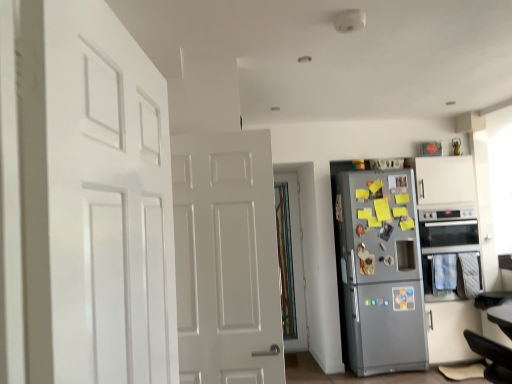
Locate an element on the screen. The image size is (512, 384). silver metallic oven at right is located at coordinates (446, 247).

Identify the location of translucent glass door at center, the 2th door positioned from the left. The width and height of the screenshot is (512, 384). (296, 261).

The image size is (512, 384). I want to click on white matte door at left, the second door in the right-to-left sequence, so click(106, 201).

Identify the location of black leather swivel chair at lower right. The height and width of the screenshot is (384, 512). (x=492, y=357).

Measure the distance between satin silver fridge at right and white matte door at left, the second door in the right-to-left sequence.

3.13 meters.

In terms of height, does satin silver fridge at right look taller or shorter compared to white matte door at left, the second door in the right-to-left sequence?

In the image, satin silver fridge at right appears to be taller than white matte door at left, the second door in the right-to-left sequence.

Is white matte door at left, the second door in the right-to-left sequence, completely or partially inside satin silver fridge at right?

Definitely not — white matte door at left, the second door in the right-to-left sequence, is not inside satin silver fridge at right.

Is satin silver fridge at right aimed at white matte door at left, the second door in the right-to-left sequence?

No, satin silver fridge at right is not facing towards white matte door at left, the second door in the right-to-left sequence.

Identify the location of oven on the right of satin silver fridge at right. The width and height of the screenshot is (512, 384). (446, 247).

Would you say silver metallic oven at right contains satin silver fridge at right?

Actually, satin silver fridge at right is outside silver metallic oven at right.

Is silver metallic oven at right turned away from satin silver fridge at right?

No, silver metallic oven at right's orientation is not away from satin silver fridge at right.

From a real-world perspective, does silver metallic oven at right sit lower than satin silver fridge at right?

Actually, silver metallic oven at right is physically above satin silver fridge at right in the real world.

Is white matte door at left, positioned as the 1th door in left-to-right order, not near translucent glass door at center, the 2th door positioned from the left?

white matte door at left, positioned as the 1th door in left-to-right order, is positioned a significant distance from translucent glass door at center, the 2th door positioned from the left.

From a real-world perspective, is white matte door at left, acting as the 2th door starting from the back, positioned above or below translucent glass door at center, acting as the 2th door starting from the front?

In terms of real-world spatial position, white matte door at left, acting as the 2th door starting from the back, is above translucent glass door at center, acting as the 2th door starting from the front.

Which object is closer to the camera, white matte door at left, arranged as the 1th door when viewed from the front, or translucent glass door at center, marked as the first door in a right-to-left arrangement?

white matte door at left, arranged as the 1th door when viewed from the front, is more forward.

Which is more to the left, white matte door at left, the second door in the right-to-left sequence, or translucent glass door at center, the 2th door positioned from the left?

white matte door at left, the second door in the right-to-left sequence, is more to the left.

From the image's perspective, who appears lower, translucent glass door at center, placed as the 1th door when sorted from back to front, or silver metallic oven at right?

translucent glass door at center, placed as the 1th door when sorted from back to front, from the image's perspective.

Looking at this image, between translucent glass door at center, acting as the 2th door starting from the front, and silver metallic oven at right, which one is positioned in front?

silver metallic oven at right is more forward.

Considering the relative sizes of translucent glass door at center, the 2th door positioned from the left, and silver metallic oven at right in the image provided, is translucent glass door at center, the 2th door positioned from the left, thinner than silver metallic oven at right?

Yes.

From the image's perspective, between black leather swivel chair at lower right and silver metallic oven at right, which one is located above?

From the image's view, silver metallic oven at right is above.

Are black leather swivel chair at lower right and silver metallic oven at right beside each other?

No, black leather swivel chair at lower right is not in contact with silver metallic oven at right.

Could silver metallic oven at right be considered to be inside black leather swivel chair at lower right?

No, silver metallic oven at right is not surrounded by black leather swivel chair at lower right.

Between point (347, 280) and point (492, 349), which one is positioned in front?

The point (492, 349) is in front.

Does satin silver fridge at right turn towards black leather swivel chair at lower right?

Yes, satin silver fridge at right is aimed at black leather swivel chair at lower right.

Who is smaller, satin silver fridge at right or black leather swivel chair at lower right?

black leather swivel chair at lower right.

From the image's perspective, which is above, satin silver fridge at right or black leather swivel chair at lower right?

satin silver fridge at right is shown above in the image.

Considering the sizes of black leather swivel chair at lower right and satin silver fridge at right in the image, is black leather swivel chair at lower right bigger or smaller than satin silver fridge at right?

In the image, black leather swivel chair at lower right appears to be smaller than satin silver fridge at right.

Is there a large distance between black leather swivel chair at lower right and satin silver fridge at right?

black leather swivel chair at lower right is far away from satin silver fridge at right.

Considering the positions of objects black leather swivel chair at lower right and satin silver fridge at right in the image provided, who is more to the right, black leather swivel chair at lower right or satin silver fridge at right?

black leather swivel chair at lower right is more to the right.

Is black leather swivel chair at lower right closer to the viewer compared to satin silver fridge at right?

Yes.

You are a GUI agent. You are given a task and a screenshot of the screen. Output one action in this format:
    pyautogui.click(x=<x>, y=<y>)
    Task: Click on the refrigerator on the right of white matte door at left, positioned as the 1th door in left-to-right order
    This screenshot has width=512, height=384.
    Given the screenshot: What is the action you would take?
    pyautogui.click(x=381, y=271)

You are a GUI agent. You are given a task and a screenshot of the screen. Output one action in this format:
    pyautogui.click(x=<x>, y=<y>)
    Task: Click on the oven located behind the satin silver fridge at right
    
    Given the screenshot: What is the action you would take?
    (446, 247)

Estimate the real-world distances between objects in this image. Which object is closer to translucent glass door at center, placed as the 1th door when sorted from back to front, satin silver fridge at right or white matte door at left, positioned as the 1th door in left-to-right order?

satin silver fridge at right is positioned closer to the anchor translucent glass door at center, placed as the 1th door when sorted from back to front.

Consider the image. Which object lies further to the anchor point black leather swivel chair at lower right, translucent glass door at center, placed as the 1th door when sorted from back to front, or silver metallic oven at right?

translucent glass door at center, placed as the 1th door when sorted from back to front, is further to black leather swivel chair at lower right.

Looking at the image, which one is located further to black leather swivel chair at lower right, satin silver fridge at right or silver metallic oven at right?

The object further to black leather swivel chair at lower right is silver metallic oven at right.

Looking at the image, which one is located closer to satin silver fridge at right, silver metallic oven at right or white matte door at left, acting as the 2th door starting from the back?

silver metallic oven at right.

From the image, which object appears to be nearer to silver metallic oven at right, white matte door at left, acting as the 2th door starting from the back, or satin silver fridge at right?

The object closer to silver metallic oven at right is satin silver fridge at right.

When comparing their distances from satin silver fridge at right, does silver metallic oven at right or black leather swivel chair at lower right seem closer?

silver metallic oven at right is closer to satin silver fridge at right.

Based on their spatial positions, is satin silver fridge at right or black leather swivel chair at lower right closer to translucent glass door at center, marked as the first door in a right-to-left arrangement?

Among the two, satin silver fridge at right is located nearer to translucent glass door at center, marked as the first door in a right-to-left arrangement.

Estimate the real-world distances between objects in this image. Which object is closer to satin silver fridge at right, translucent glass door at center, acting as the 2th door starting from the front, or silver metallic oven at right?

silver metallic oven at right is positioned closer to the anchor satin silver fridge at right.

This screenshot has width=512, height=384. I want to click on refrigerator positioned between black leather swivel chair at lower right and silver metallic oven at right from near to far, so click(x=381, y=271).

Identify the location of refrigerator situated between translucent glass door at center, placed as the 1th door when sorted from back to front, and silver metallic oven at right from left to right. (381, 271).

Locate an element on the screen. Image resolution: width=512 pixels, height=384 pixels. oven between black leather swivel chair at lower right and translucent glass door at center, acting as the 2th door starting from the front, from front to back is located at coordinates (446, 247).

Where is `refrigerator located between black leather swivel chair at lower right and translucent glass door at center, the 2th door positioned from the left, in the depth direction`? The height and width of the screenshot is (384, 512). refrigerator located between black leather swivel chair at lower right and translucent glass door at center, the 2th door positioned from the left, in the depth direction is located at coordinates (381, 271).